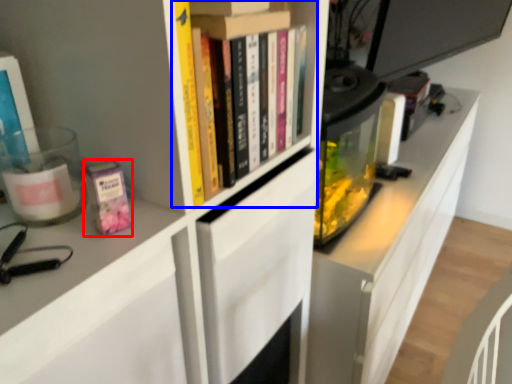
Question: Among these objects, which one is farthest to the camera, paperback book (highlighted by a red box) or book (highlighted by a blue box)?

Choices:
 (A) paperback book
 (B) book

Answer: (B)